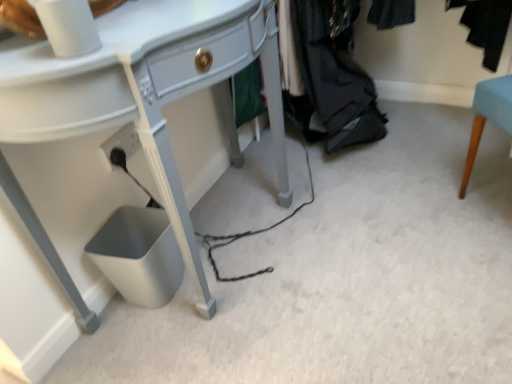
The width and height of the screenshot is (512, 384). What are the coordinates of `vacant space situated on the left part of dark gray fabric at lower right` in the screenshot? It's located at (268, 164).